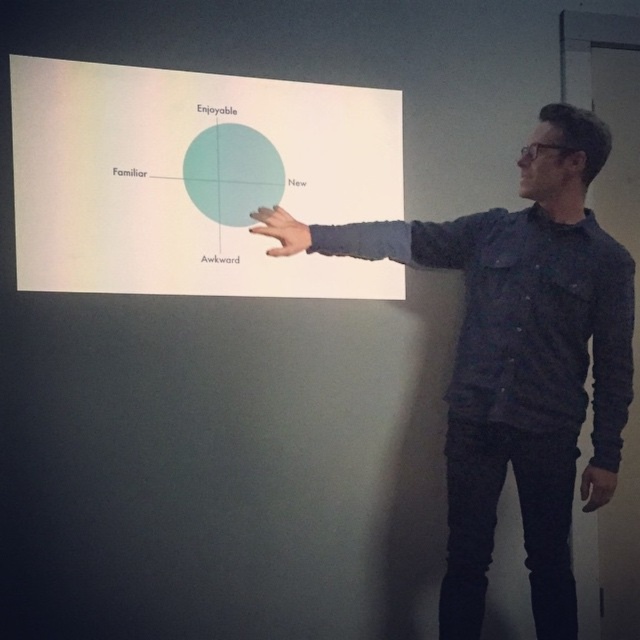
You are an attendee at a presentation and see the presenter pointing at the projection screen. The presenter has a matte black hand at upper center and there is a matte teal circle at center. Which object is closer to you, the attendee?

The matte teal circle at center is closer to you because it is further to the viewer than the matte black hand at upper center.

The scene shows a person pointing at a projection screen with a quadrant graph. The person is pointing at a specific location on the graph. Which quadrant is the point labeled as point (193, 179) located in?

The white paper at center is represented by point (193, 179), so the point is in the center quadrant.

You are a presenter standing in front of the projection screen. You want to ensure your matte black hand at upper center can reach the matte teal circle at center to point at it. If your arm can extend 8 inches, will you be able to reach it?

The distance between the matte teal circle at center and the matte black hand at upper center is 8.22 inches. Since your arm can only extend 8 inches, you will not be able to reach the matte teal circle at center with your current arm extension.